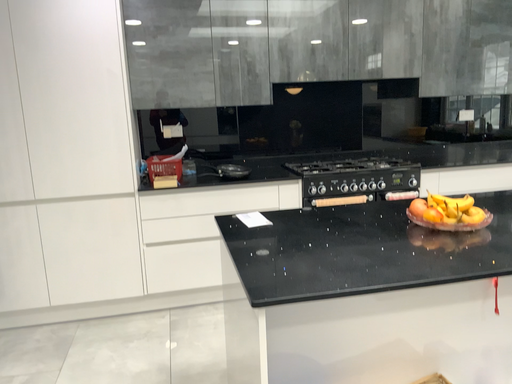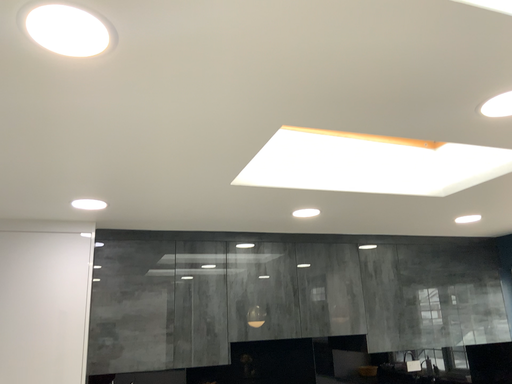
Question: Which way did the camera rotate in the video?

Choices:
 (A) rotated right
 (B) rotated left

Answer: (A)